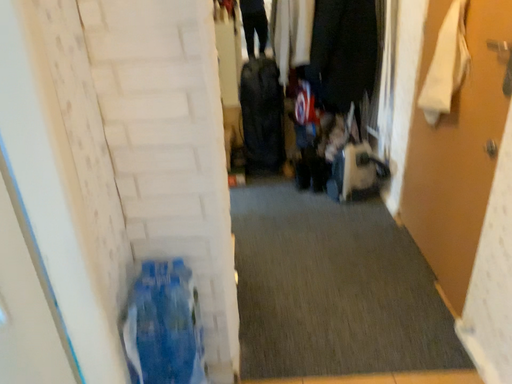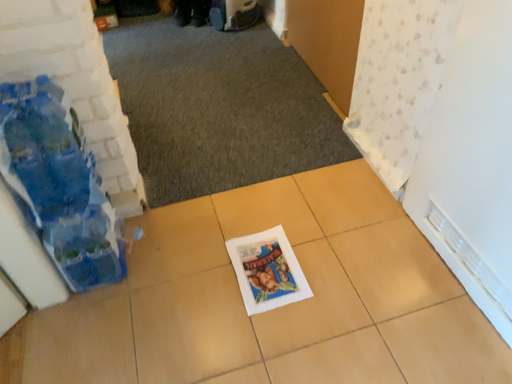
Question: How did the camera likely rotate when shooting the video?

Choices:
 (A) rotated left
 (B) rotated right

Answer: (B)